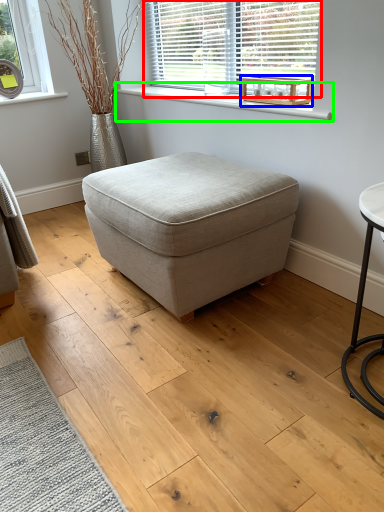
Question: Which object is positioned farthest from window (highlighted by a red box)? Select from round table (highlighted by a blue box) and window sill (highlighted by a green box).

Choices:
 (A) round table
 (B) window sill

Answer: (A)